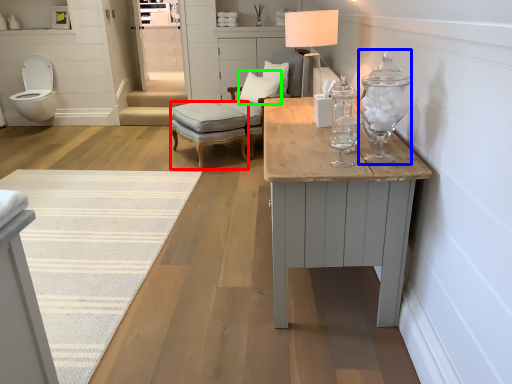
Question: Which object is positioned closest to stool (highlighted by a red box)? Select from candle holder (highlighted by a blue box) and pillow (highlighted by a green box).

Choices:
 (A) candle holder
 (B) pillow

Answer: (B)